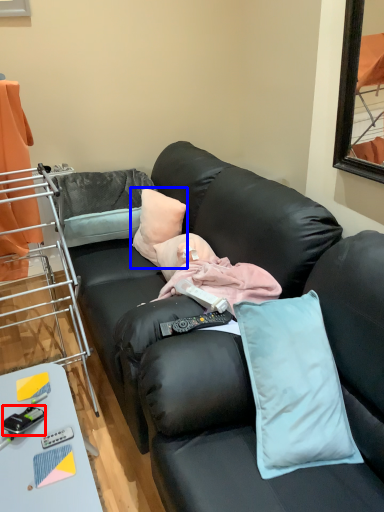
Question: Which point is closer to the camera, equipment (highlighted by a red box) or pillow (highlighted by a blue box)?

Choices:
 (A) equipment
 (B) pillow

Answer: (A)